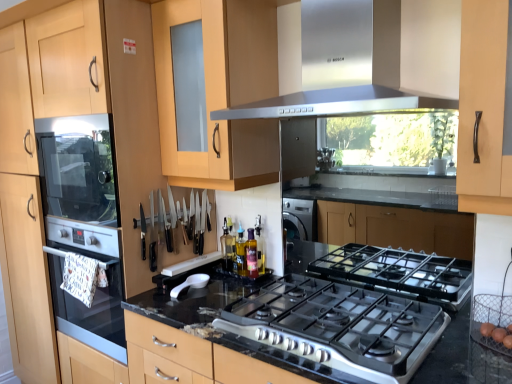
Question: From a real-world perspective, is translucent glass bottle at center, placed as the 1th bottle when sorted from right to left, physically located above or below white plastic spoon at center?

Choices:
 (A) below
 (B) above

Answer: (B)

Question: From the image's perspective, is translucent glass bottle at center, placed as the 1th bottle when sorted from right to left, positioned above or below white plastic spoon at center?

Choices:
 (A) below
 (B) above

Answer: (B)

Question: Estimate the real-world distances between objects in this image. Which object is closer to the black granite countertop at center?

Choices:
 (A) black plastic knives at center
 (B) light wood/texture cabinet at left
 (C) translucent glass bottle at center, which is counted as the first bottle, starting from the front
 (D) white plastic spoon at center
 (E) stainless steel range hood at upper center

Answer: (D)

Question: Which object is the farthest from the white plastic spoon at center?

Choices:
 (A) stainless steel range hood at upper center
 (B) black granite countertop at center
 (C) translucent glass bottle at center, which is the second bottle in back-to-front order
 (D) translucent glass bottle at center, marked as the 1th bottle in a back-to-front arrangement
 (E) light wood/texture cabinet at left

Answer: (A)